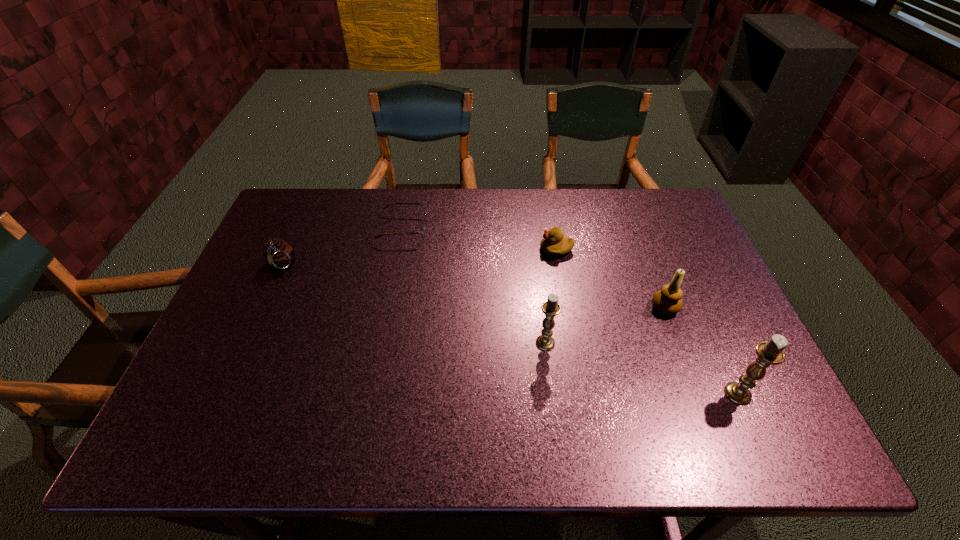
You are a GUI agent. You are given a task and a screenshot of the screen. Output one action in this format:
    pyautogui.click(x=<x>, y=<y>)
    Task: Click on the object that is at the near edge
    Image resolution: width=960 pixels, height=540 pixels.
    Given the screenshot: What is the action you would take?
    pyautogui.click(x=770, y=352)

Locate an element on the screen. object that is positioned at the left edge is located at coordinates (279, 255).

You are a GUI agent. You are given a task and a screenshot of the screen. Output one action in this format:
    pyautogui.click(x=<x>, y=<y>)
    Task: Click on the object that is positioned at the near right corner
    This screenshot has height=540, width=960.
    Given the screenshot: What is the action you would take?
    pyautogui.click(x=770, y=352)

The image size is (960, 540). Identify the location of blank area at the far edge. (491, 197).

Find the location of a particular element. This screenshot has height=540, width=960. vacant region at the near edge of the desktop is located at coordinates (698, 388).

Image resolution: width=960 pixels, height=540 pixels. In the image, there is a desktop. What are the coordinates of `vacant area at the left edge` in the screenshot? It's located at (265, 349).

Locate an element on the screen. The width and height of the screenshot is (960, 540). free space at the right edge of the desktop is located at coordinates (698, 353).

The width and height of the screenshot is (960, 540). What are the coordinates of `free space at the far right corner` in the screenshot? It's located at (641, 197).

The height and width of the screenshot is (540, 960). I want to click on empty space that is in between the fourth shortest object and the second object from left to right, so click(x=534, y=268).

Find the location of a particular element. free space that is in between the second candle_holder from right to left and the duckling is located at coordinates (611, 278).